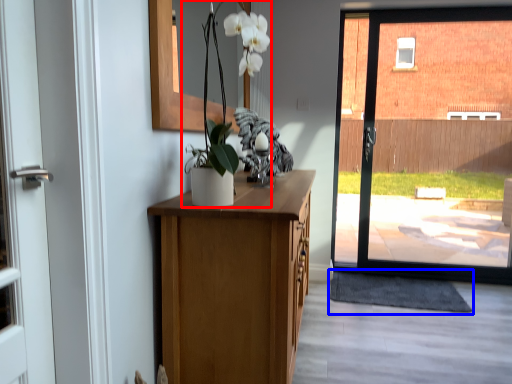
Question: Which object is closer to the camera taking this photo, floral arrangement (highlighted by a red box) or doormat (highlighted by a blue box)?

Choices:
 (A) floral arrangement
 (B) doormat

Answer: (A)